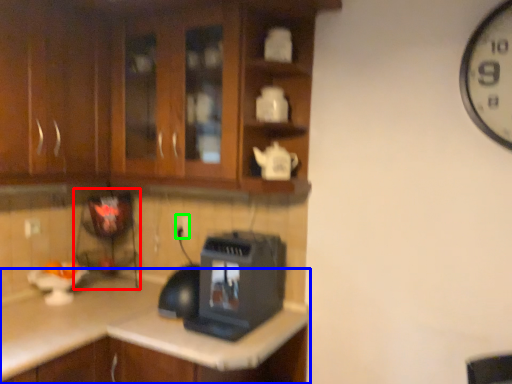
Question: Considering the real-world distances, which object is farthest from appliance (highlighted by a red box)? countertop (highlighted by a blue box) or electric outlet (highlighted by a green box)?

Choices:
 (A) countertop
 (B) electric outlet

Answer: (A)